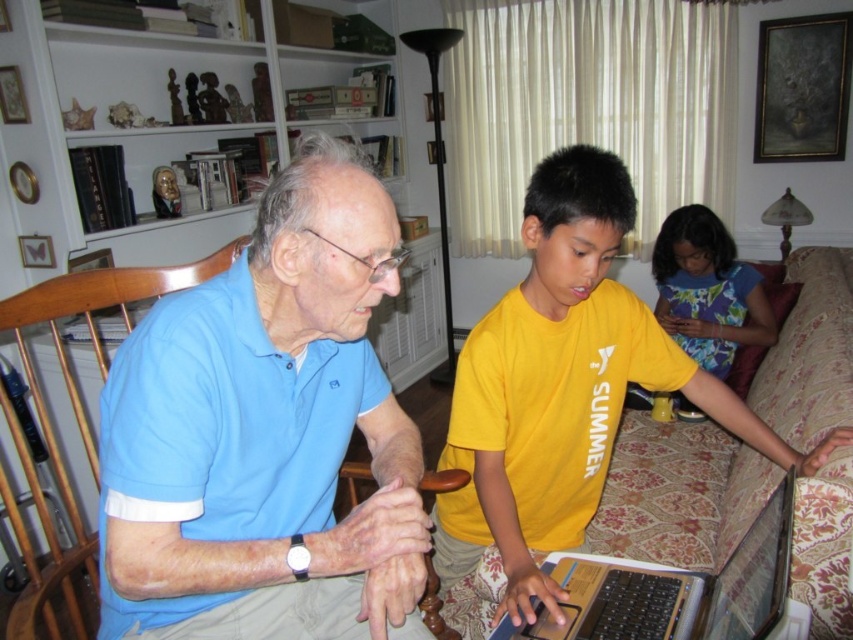
You are a photographer setting up a shoot in this living room. You need to position a light source so that it illuminates both the yellow cotton shirt at center and the floral fabric dress at center equally. Given their positions, which object should be placed closer to the light source to achieve even illumination?

The yellow cotton shirt at center is located below the floral fabric dress at center. To achieve even illumination, the yellow cotton shirt at center should be placed closer to the light source since it is farther away from the light source than the floral fabric dress at center.

You are a delivery person who needs to place a small package between the yellow cotton shirt at center and the white plastic laptop at lower center. Can you fit the package if it measures 10 inches in length?

The yellow cotton shirt at center and white plastic laptop at lower center are 10.05 inches apart from each other. Since the package is 10 inches long, it can fit between them as the space is slightly larger than the package.

In the scene shown: Where is the light blue cotton shirt at left located in the image?

The light blue cotton shirt at left is located at point (x=265, y=435) in the image.